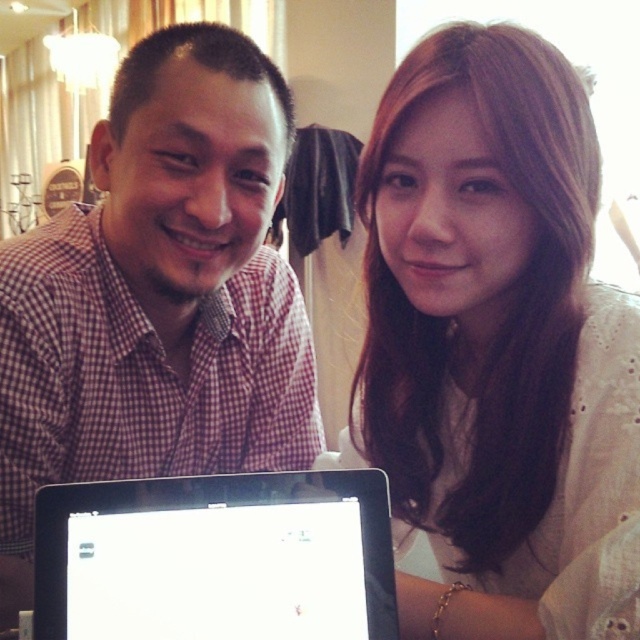
You are a photographer setting up for a group photo. You need to ensure that the white lace shirt at upper right and the black glossy laptop at center are both visible in the frame. Given their sizes, which object should you prioritize positioning closer to the camera to maintain clarity?

The white lace shirt at upper right should be positioned closer to the camera because it is smaller than the black glossy laptop at center, ensuring its details remain clear in the photo.

You are at the point with coordinates point (x=128, y=499) and want to move to the exit located at point (x=440, y=621). Is the exit behind you?

Point (x=440, y=621) is behind point (x=128, y=499), so yes, the exit is behind you.

You are a photographer trying to capture the interaction between the two people in the scene. Since the checkered fabric shirt at center and the black glossy laptop at center are both at the center, which one is positioned to the left?

The checkered fabric shirt at center is to the left of the black glossy laptop at center.